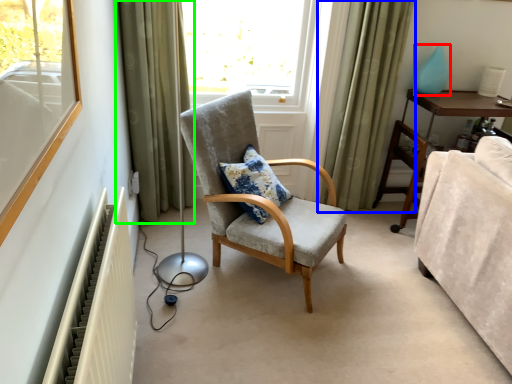
Question: Which object is the farthest from teal (highlighted by a red box)? Choose among these: curtain (highlighted by a blue box) or curtain (highlighted by a green box).

Choices:
 (A) curtain
 (B) curtain

Answer: (B)